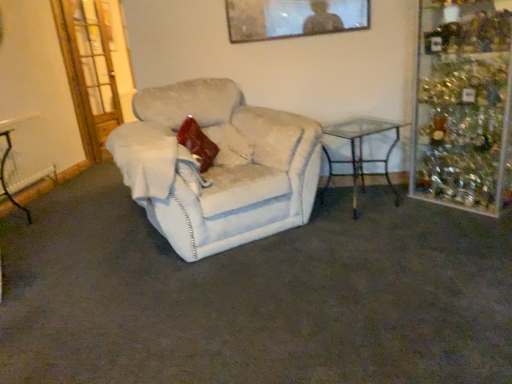
Question: From a real-world perspective, relative to white fabric chair at center, is metallic silver picture frame at upper center vertically above or below?

Choices:
 (A) above
 (B) below

Answer: (A)

Question: Is metallic silver picture frame at upper center wider or thinner than white fabric chair at center?

Choices:
 (A) wide
 (B) thin

Answer: (B)

Question: Estimate the real-world distances between objects in this image. Which object is closer to the velvet red pillow at center?

Choices:
 (A) white fabric chair at center
 (B) metallic wire table at left, which is the second table from right to left
 (C) metallic silver picture frame at upper center
 (D) clear glass table at right, the second table positioned from the left
 (E) wooden glass door at left

Answer: (A)

Question: Estimate the real-world distances between objects in this image. Which object is closer to the clear glass table at right, the 1th table viewed from the right?

Choices:
 (A) velvet red pillow at center
 (B) white fabric chair at center
 (C) wooden glass door at left
 (D) metallic silver picture frame at upper center
 (E) metallic wire table at left, the first table viewed from the left

Answer: (B)